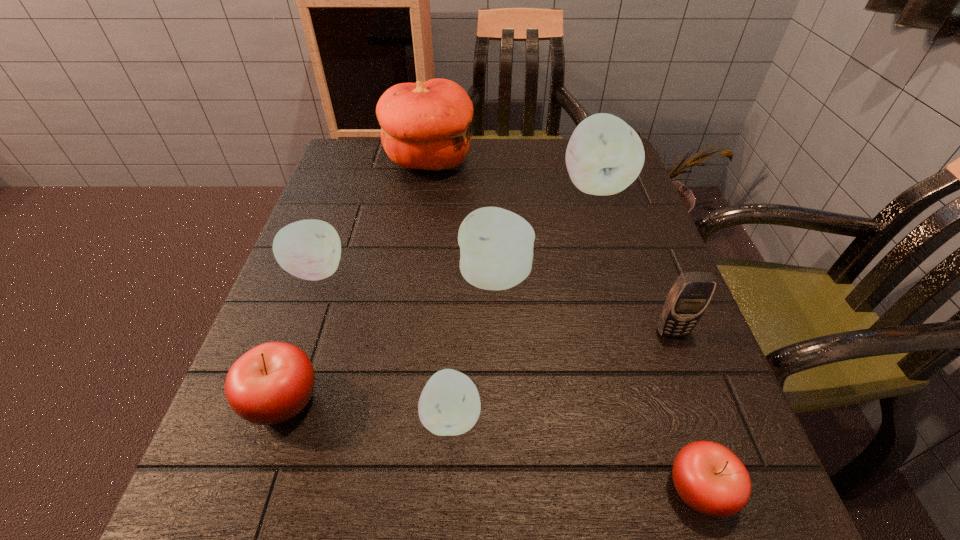
In order to click on pumpkin in this screenshot , I will do `click(425, 125)`.

Where is `the biggest white apple`? the biggest white apple is located at coordinates (604, 155).

Find the location of a particular element. Image resolution: width=960 pixels, height=540 pixels. the tallest apple is located at coordinates (604, 155).

Locate an element on the screen. The width and height of the screenshot is (960, 540). the fifth shortest apple is located at coordinates (496, 245).

I want to click on cellular telephone, so click(x=687, y=300).

At what (x,y) coordinates should I click in order to perform the action: click on the second smallest white apple. Please return your answer as a coordinate pair (x, y). Looking at the image, I should click on (310, 249).

The width and height of the screenshot is (960, 540). Find the location of `the bigger red apple`. the bigger red apple is located at coordinates (271, 383).

Locate an element on the screen. This screenshot has height=540, width=960. the left red apple is located at coordinates (271, 383).

The width and height of the screenshot is (960, 540). In order to click on the nearest white apple in this screenshot , I will do pos(449,405).

Image resolution: width=960 pixels, height=540 pixels. In order to click on the nearer red apple in this screenshot , I will do (x=709, y=478).